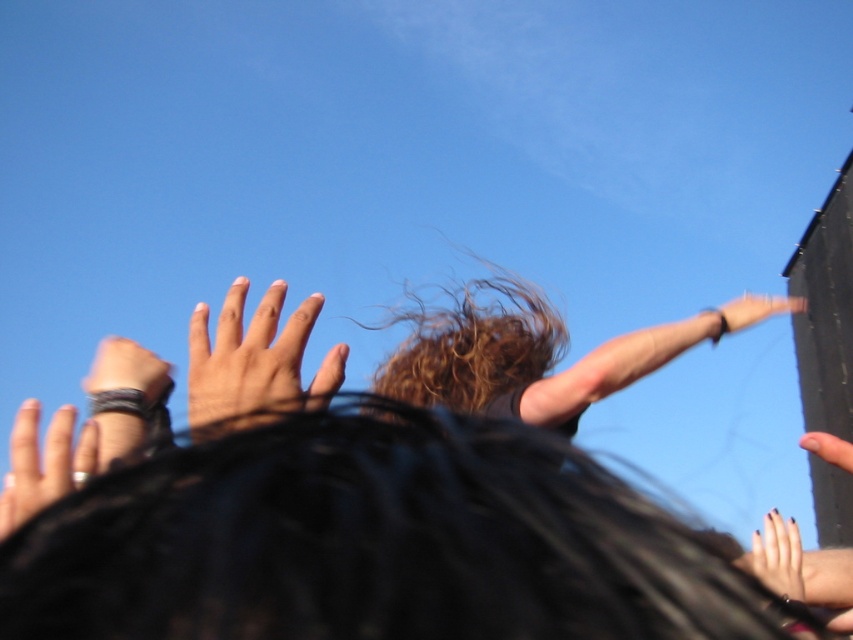
You are attending an outdoor event and notice two people in the crowd. One has black matte hair at center and another has dark brown hair at upper right. Which person takes up more space in your view?

The dark brown hair at upper right takes up more space in your view because the black matte hair at center occupies less space than dark brown hair at upper right.

You are a photographer at the event and want to capture a photo that includes both the dark brown hair at upper right and the smooth skin hand at left. Given that your camera has a maximum focus range of 3 meters, will you be able to include both subjects in the same frame without moving the camera?

The distance between the dark brown hair at upper right and the smooth skin hand at left is 2.99 meters, which is within the camera maximum focus range of 3 meters. Therefore, you can capture both subjects in the same frame without moving the camera.

In the scene shown: You are a photographer at the event trying to capture a wide shot. The black matte hair at center and the dark brown hair at upper right are both in your frame. Which hair should you focus on to ensure it fits entirely within your camera viewfinder if the viewfinder can only accommodate the narrower of the two?

The black matte hair at center has a smaller width compared to the dark brown hair at upper right. Since the viewfinder can only accommodate the narrower one, you should focus on the black matte hair at center to ensure it fits entirely within the camera viewfinder.